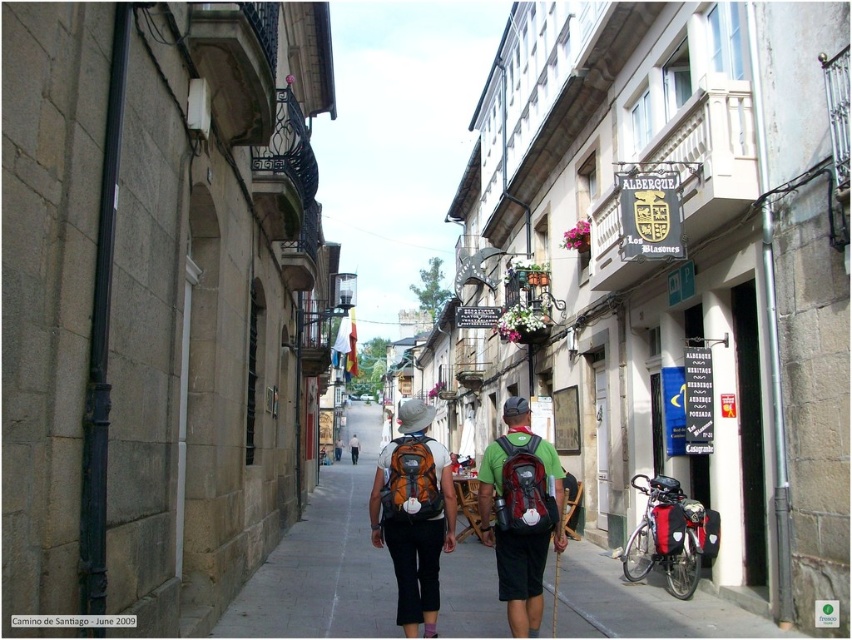
You are a pilgrim on the Camino de Santiago and you see two backpacks, a matte orange backpack at center and a matte green backpack at center, on the narrow street. Which backpack is positioned lower on the street?

The matte orange backpack at center is positioned lower than the matte green backpack at center, so the matte orange backpack at center is lower on the street.

You are standing on the narrow street in the European town and want to walk from point (419,444) to point (534,522). Which direction should you turn to face the correct path?

Since point (419,444) is closer to you than point (534,522), you should move forward towards the point that is further away. However, the exact direction depends on the layout of the street and buildings, which isn